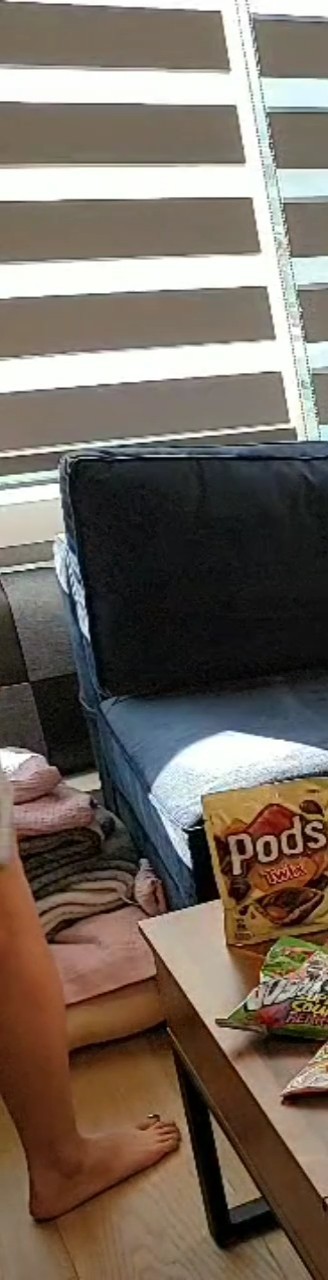
Identify the location of pillow. (31, 672).